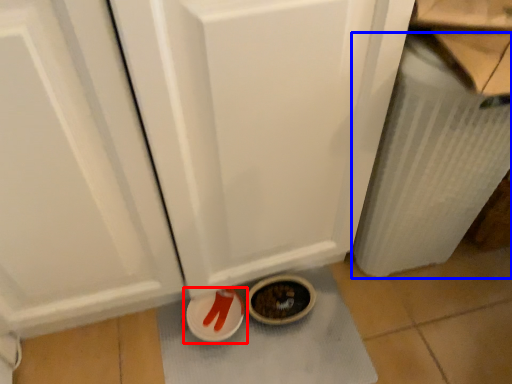
Question: Which of the following is the farthest to the observer, footwear (highlighted by a red box) or radiator (highlighted by a blue box)?

Choices:
 (A) footwear
 (B) radiator

Answer: (A)